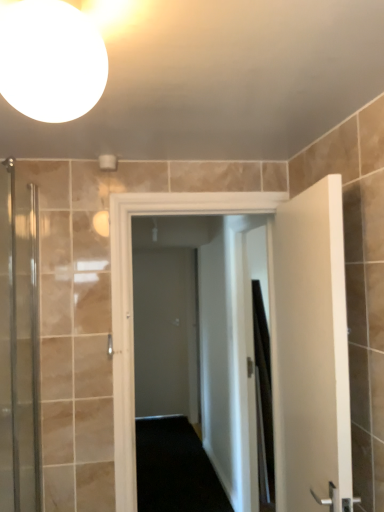
Question: Can you confirm if white glossy sphere at upper left is wider than white matte door at right, the 2th door from the left?

Choices:
 (A) no
 (B) yes

Answer: (B)

Question: From a real-world perspective, is white glossy sphere at upper left located beneath white matte door at right, which appears as the 1th door when viewed from the right?

Choices:
 (A) no
 (B) yes

Answer: (A)

Question: Is white glossy sphere at upper left further to camera compared to white matte door at right, which appears as the 1th door when viewed from the right?

Choices:
 (A) no
 (B) yes

Answer: (A)

Question: Is white glossy sphere at upper left to the right of white matte door at right, which appears as the 1th door when viewed from the right, from the viewer's perspective?

Choices:
 (A) yes
 (B) no

Answer: (B)

Question: Is white matte door at right, the 2th door from the left, located within white glossy sphere at upper left?

Choices:
 (A) yes
 (B) no

Answer: (B)

Question: Considering the relative sizes of white glossy sphere at upper left and white matte door at right, the 2th door from the left, in the image provided, is white glossy sphere at upper left shorter than white matte door at right, the 2th door from the left,?

Choices:
 (A) yes
 (B) no

Answer: (A)

Question: From the image's perspective, is white glossy sphere at upper left over gray matte door at center?

Choices:
 (A) no
 (B) yes

Answer: (B)

Question: Is white glossy sphere at upper left far from gray matte door at center?

Choices:
 (A) yes
 (B) no

Answer: (A)

Question: Does white glossy sphere at upper left have a lesser height compared to gray matte door at center?

Choices:
 (A) yes
 (B) no

Answer: (A)

Question: Is white glossy sphere at upper left further to camera compared to gray matte door at center?

Choices:
 (A) no
 (B) yes

Answer: (A)

Question: Is the depth of white glossy sphere at upper left less than that of gray matte door at center?

Choices:
 (A) yes
 (B) no

Answer: (A)

Question: From a real-world perspective, is white glossy sphere at upper left below gray matte door at center?

Choices:
 (A) no
 (B) yes

Answer: (A)

Question: Is clear glass shower door at left outside of white glossy sphere at upper left?

Choices:
 (A) yes
 (B) no

Answer: (A)